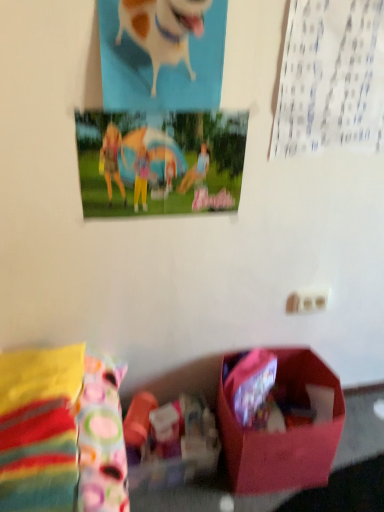
Question: Can you confirm if white glossy dog at upper center is taller than matte plastic poster at upper center?

Choices:
 (A) yes
 (B) no

Answer: (A)

Question: Is white glossy dog at upper center outside matte plastic poster at upper center?

Choices:
 (A) no
 (B) yes

Answer: (B)

Question: Is white glossy dog at upper center smaller than matte plastic poster at upper center?

Choices:
 (A) yes
 (B) no

Answer: (B)

Question: From a real-world perspective, is white glossy dog at upper center physically above matte plastic poster at upper center?

Choices:
 (A) yes
 (B) no

Answer: (A)

Question: From a real-world perspective, is white glossy dog at upper center located beneath matte plastic poster at upper center?

Choices:
 (A) no
 (B) yes

Answer: (A)

Question: Is matte plastic poster at upper center at the back of white glossy dog at upper center?

Choices:
 (A) no
 (B) yes

Answer: (A)

Question: Is matte pink box at lower center shorter than matte plastic poster at upper center?

Choices:
 (A) no
 (B) yes

Answer: (A)

Question: Considering the relative sizes of matte pink box at lower center and matte plastic poster at upper center in the image provided, is matte pink box at lower center wider than matte plastic poster at upper center?

Choices:
 (A) yes
 (B) no

Answer: (A)

Question: Does matte pink box at lower center come behind matte plastic poster at upper center?

Choices:
 (A) no
 (B) yes

Answer: (B)

Question: Is matte pink box at lower center turned away from matte plastic poster at upper center?

Choices:
 (A) yes
 (B) no

Answer: (B)

Question: Is matte plastic poster at upper center inside matte pink box at lower center?

Choices:
 (A) no
 (B) yes

Answer: (A)

Question: Is matte pink box at lower center positioned far away from matte plastic poster at upper center?

Choices:
 (A) no
 (B) yes

Answer: (A)

Question: From a real-world perspective, is white glossy dog at upper center on top of matte pink box at lower center?

Choices:
 (A) yes
 (B) no

Answer: (A)